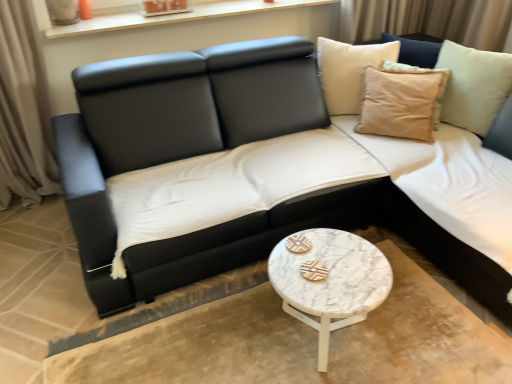
What do you see at coordinates (329, 280) in the screenshot? The height and width of the screenshot is (384, 512). I see `white marble coffee table at center` at bounding box center [329, 280].

You are a GUI agent. You are given a task and a screenshot of the screen. Output one action in this format:
    pyautogui.click(x=<x>, y=<y>)
    Task: Click on the white marble coffee table at center
    The width and height of the screenshot is (512, 384).
    Given the screenshot: What is the action you would take?
    pyautogui.click(x=329, y=280)

What is the approximate height of black leather couch at center?

black leather couch at center is 32.92 inches in height.

Identify the location of beige cotton cushion at upper right. This screenshot has height=384, width=512. (401, 102).

Which of these two, black leather couch at center or white marble coffee table at center, is wider?

Wider between the two is black leather couch at center.

Does point (124, 260) lie in front of point (309, 250)?

No, it is behind (309, 250).

I want to click on coffee table beneath the black leather couch at center (from a real-world perspective), so click(329, 280).

Is black leather couch at center at the left side of white marble coffee table at center?

Indeed, black leather couch at center is positioned on the left side of white marble coffee table at center.

Is beige cotton cushion at upper right not close to black leather couch at center?

No, there isn't a large distance between beige cotton cushion at upper right and black leather couch at center.

In the scene shown: Could you tell me if beige cotton cushion at upper right is turned towards black leather couch at center?

Yes, beige cotton cushion at upper right is facing black leather couch at center.

Does point (417, 99) lie in front of point (216, 62)?

No.

From a real-world perspective, which object rests below the other?

From a 3D spatial view, black leather couch at center is below.

From a real-world perspective, is black leather couch at center on white wood window sill at upper center?

No, from a real-world perspective, black leather couch at center is not on top of white wood window sill at upper center.

Which object is wider, black leather couch at center or white wood window sill at upper center?

black leather couch at center.

Considering the relative sizes of black leather couch at center and white wood window sill at upper center in the image provided, is black leather couch at center bigger than white wood window sill at upper center?

Yes, black leather couch at center is bigger than white wood window sill at upper center.

The height and width of the screenshot is (384, 512). I want to click on window sill on the left of the black leather couch at center, so click(176, 16).

Is beige cotton cushion at upper right a part of white marble coffee table at center?

No, beige cotton cushion at upper right is not surrounded by white marble coffee table at center.

Which object is wider, white marble coffee table at center or beige cotton cushion at upper right?

Wider between the two is white marble coffee table at center.

Which object is closer to the camera, white marble coffee table at center or beige cotton cushion at upper right?

white marble coffee table at center is closer to the camera.

The width and height of the screenshot is (512, 384). What are the coordinates of `coffee table below the beige cotton cushion at upper right (from the image's perspective)` in the screenshot? It's located at (329, 280).

Considering the sizes of objects white wood window sill at upper center and white marble coffee table at center in the image provided, who is taller, white wood window sill at upper center or white marble coffee table at center?

Standing taller between the two is white marble coffee table at center.

Is white wood window sill at upper center oriented towards white marble coffee table at center?

No, white wood window sill at upper center does not turn towards white marble coffee table at center.

Is white marble coffee table at center surrounded by white wood window sill at upper center?

That's incorrect, white marble coffee table at center is not inside white wood window sill at upper center.

How different are the orientations of white marble coffee table at center and black leather couch at center in degrees?

The angle between the facing direction of white marble coffee table at center and the facing direction of black leather couch at center is 8.91e-05 degrees.

Are white marble coffee table at center and black leather couch at center making contact?

No, white marble coffee table at center is not in contact with black leather couch at center.

Considering the sizes of objects white marble coffee table at center and black leather couch at center in the image provided, who is wider, white marble coffee table at center or black leather couch at center?

black leather couch at center.

Image resolution: width=512 pixels, height=384 pixels. Identify the location of studio couch above the white marble coffee table at center (from a real-world perspective). (213, 152).

Is white marble coffee table at center positioned with its back to white wood window sill at upper center?

Yes, white marble coffee table at center is facing away from white wood window sill at upper center.

In terms of width, does white marble coffee table at center look wider or thinner when compared to white wood window sill at upper center?

In the image, white marble coffee table at center appears to be wider than white wood window sill at upper center.

Which point is more distant from viewer, (335, 229) or (219, 15)?

The point (219, 15) is farther.

Considering the sizes of objects white marble coffee table at center and white wood window sill at upper center in the image provided, who is taller, white marble coffee table at center or white wood window sill at upper center?

With more height is white marble coffee table at center.

This screenshot has height=384, width=512. Find the location of `studio couch that is on the left side of white marble coffee table at center`. studio couch that is on the left side of white marble coffee table at center is located at coordinates point(213,152).

Identify the location of studio couch in front of the beige cotton cushion at upper right. (213, 152).

Looking at the image, which one is located further to white marble coffee table at center, white wood window sill at upper center or black leather couch at center?

white wood window sill at upper center lies further to white marble coffee table at center than the other object.

Looking at the image, which one is located closer to white wood window sill at upper center, black leather couch at center or beige cotton cushion at upper right?

black leather couch at center is positioned closer to the anchor white wood window sill at upper center.

Which object lies further to the anchor point white marble coffee table at center, black leather couch at center or beige cotton cushion at upper right?

The object further to white marble coffee table at center is beige cotton cushion at upper right.

Based on the photo, which object lies further to the anchor point white wood window sill at upper center, beige cotton cushion at upper right or black leather couch at center?

Based on the image, beige cotton cushion at upper right appears to be further to white wood window sill at upper center.

From the image, which object appears to be nearer to black leather couch at center, white wood window sill at upper center or white marble coffee table at center?

white marble coffee table at center lies closer to black leather couch at center than the other object.

Which object lies further to the anchor point beige cotton cushion at upper right, white marble coffee table at center or white wood window sill at upper center?

white wood window sill at upper center is further to beige cotton cushion at upper right.

From the image, which object appears to be farther from black leather couch at center, white marble coffee table at center or beige cotton cushion at upper right?

beige cotton cushion at upper right lies further to black leather couch at center than the other object.

Considering their positions, is white marble coffee table at center positioned further to beige cotton cushion at upper right than black leather couch at center?

white marble coffee table at center.

I want to click on studio couch situated between white wood window sill at upper center and beige cotton cushion at upper right from left to right, so click(213, 152).

At what (x,y) coordinates should I click in order to perform the action: click on studio couch between white wood window sill at upper center and white marble coffee table at center in the vertical direction. Please return your answer as a coordinate pair (x, y). This screenshot has width=512, height=384. Looking at the image, I should click on (213, 152).

This screenshot has width=512, height=384. In order to click on coffee table between black leather couch at center and beige cotton cushion at upper right in the horizontal direction in this screenshot , I will do `click(329, 280)`.

Image resolution: width=512 pixels, height=384 pixels. Identify the location of pillow between white wood window sill at upper center and white marble coffee table at center in the up-down direction. (401, 102).